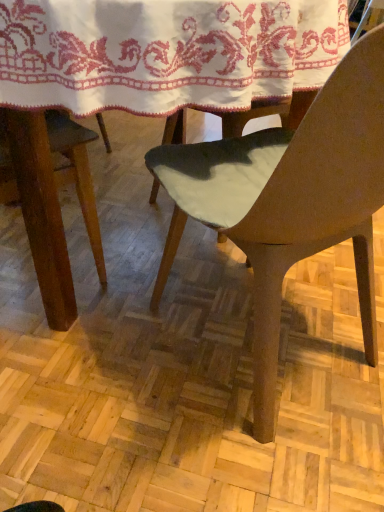
Identify the location of vacant space situated on the left part of matte brown chair at center. This screenshot has width=384, height=512. (93, 350).